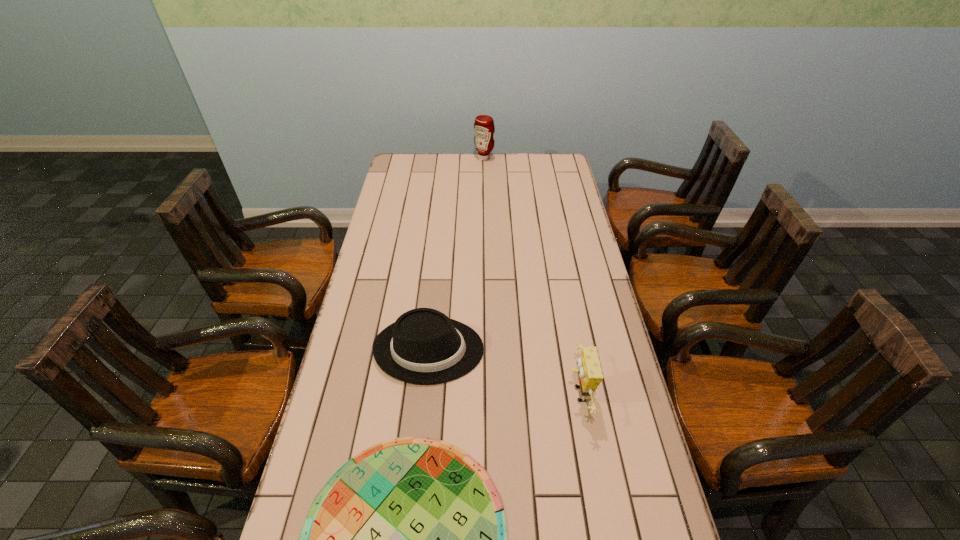
Locate an element on the screen. object identified as the second closest to the nearest object is located at coordinates (589, 370).

The height and width of the screenshot is (540, 960). I want to click on the third closest object to the farthest object, so click(x=408, y=539).

I want to click on vacant space that satisfies the following two spatial constraints: 1. on the front side of the condiment; 2. on the front-facing side of the fedora, so click(487, 349).